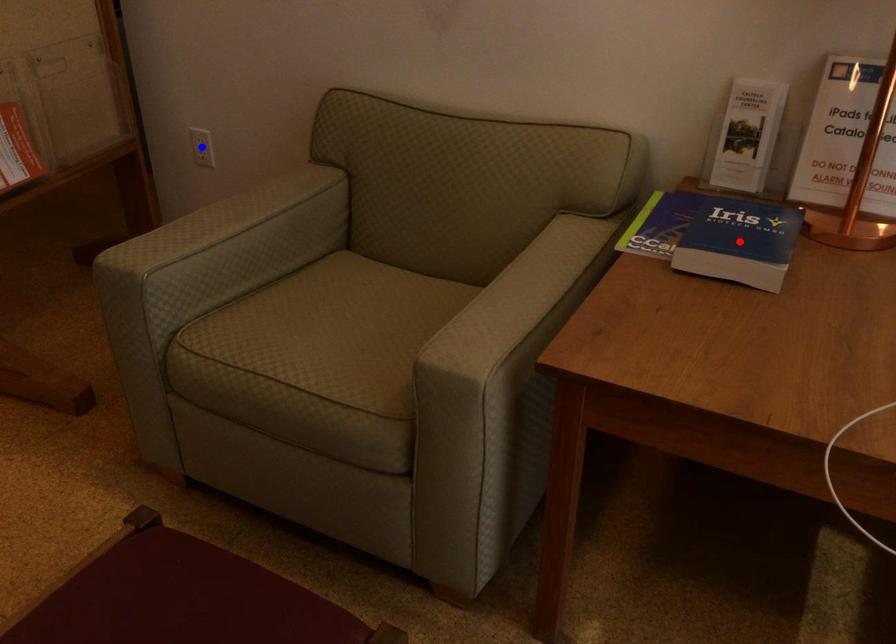
Question: In the image, two points are highlighted. Which point is nearer to the camera? Reply with the corresponding letter.

Choices:
 (A) blue point
 (B) red point

Answer: (B)